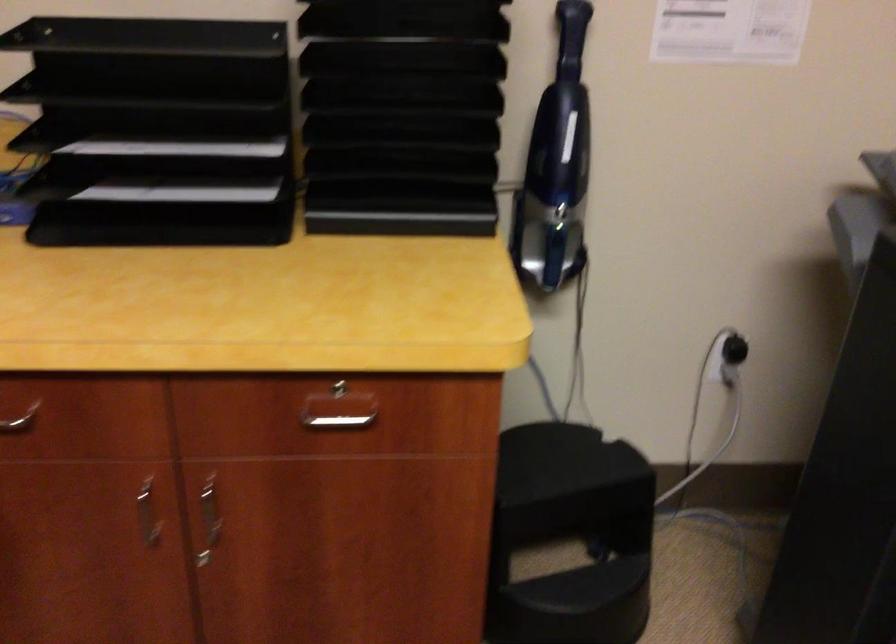
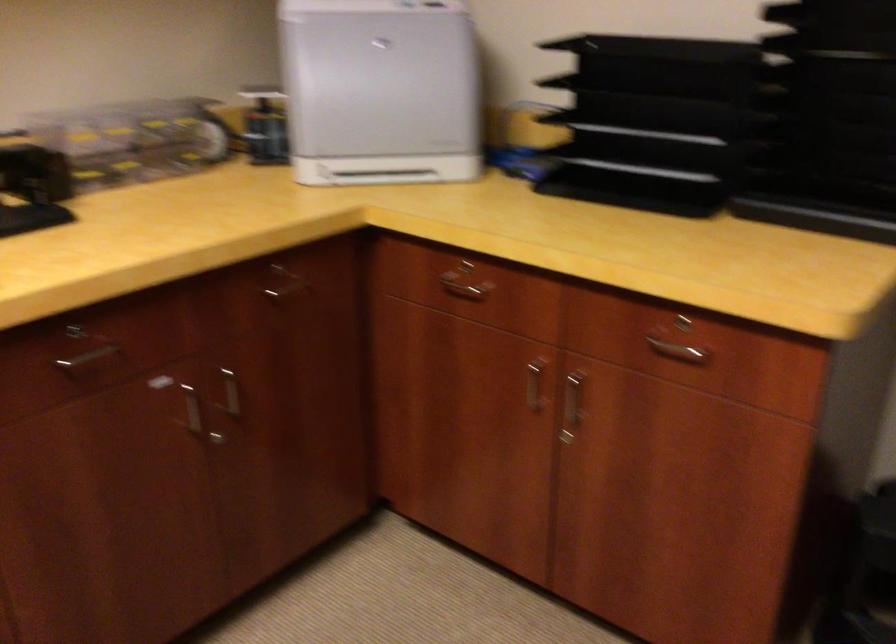
Where in the second image is the point corresponding to (x=159, y=218) from the first image?

(632, 190)